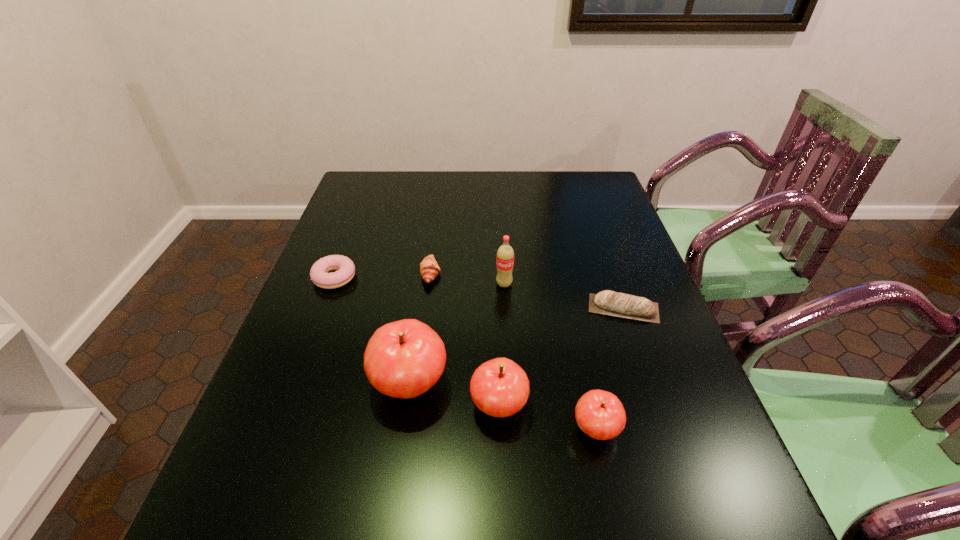
This screenshot has width=960, height=540. In the image, there is a desktop. What are the coordinates of `vacant area at the left edge` in the screenshot? It's located at (355, 225).

Find the location of a particular element. free space at the right edge of the desktop is located at coordinates (598, 220).

I want to click on free space at the near left corner of the desktop, so click(306, 456).

The image size is (960, 540). What are the coordinates of `vacant space at the far right corner` in the screenshot? It's located at (572, 191).

Locate an element on the screen. The width and height of the screenshot is (960, 540). blank region between the tallest apple and the doughnut is located at coordinates (372, 331).

I want to click on free space between the pastry and the fourth farthest object, so click(x=527, y=291).

This screenshot has height=540, width=960. In order to click on vacant space that is in between the pita bread and the third tallest object in this screenshot , I will do `click(561, 357)`.

The image size is (960, 540). Identify the location of vacant space in between the second apple from left to right and the fourth farthest object. (561, 357).

The height and width of the screenshot is (540, 960). I want to click on empty space that is in between the pita bread and the tallest apple, so point(516,347).

This screenshot has width=960, height=540. Identify the location of free space between the fourth nearest object and the soda. (564, 296).